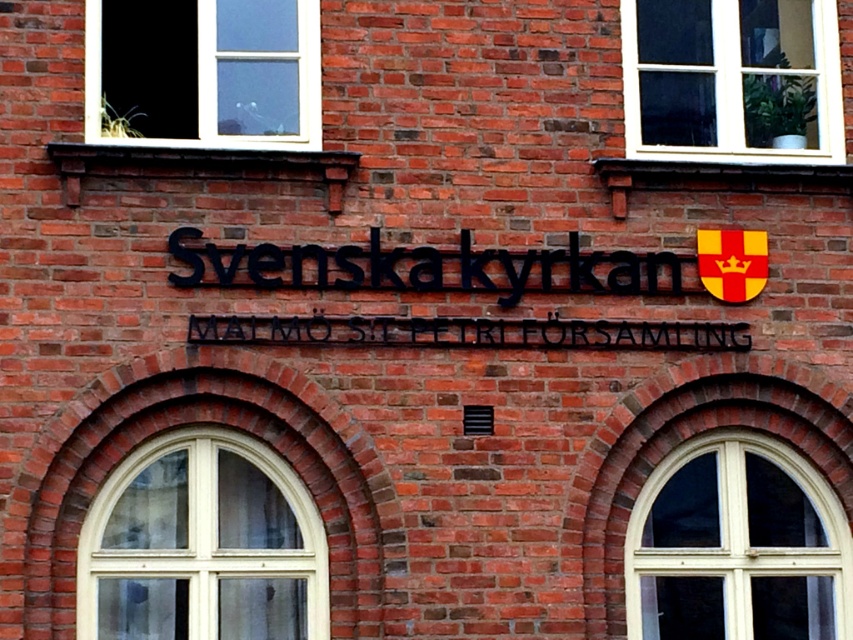
Is white wood window at lower left to the right of clear glass window at upper left from the viewer's perspective?

Correct, you'll find white wood window at lower left to the right of clear glass window at upper left.

Between white wood window at lower left and clear glass window at upper left, which one is positioned lower?

Positioned lower is white wood window at lower left.

Does point (165, 534) lie in front of point (154, 84)?

Yes, point (165, 534) is in front of point (154, 84).

Where is `white wood window at lower left`? This screenshot has width=853, height=640. white wood window at lower left is located at coordinates (202, 545).

Is white wood window at lower left closer to the viewer compared to white wooden window at lower right?

Yes, white wood window at lower left is in front of white wooden window at lower right.

Is point (146, 592) more distant than point (757, 476)?

No.

Identify the location of white wood window at lower left. click(x=202, y=545).

Does white wood window at lower left appear under black metal sign at center?

Correct, white wood window at lower left is located below black metal sign at center.

Find the location of a particular element. white wood window at lower left is located at coordinates (202, 545).

Identify the location of white wood window at lower left. (202, 545).